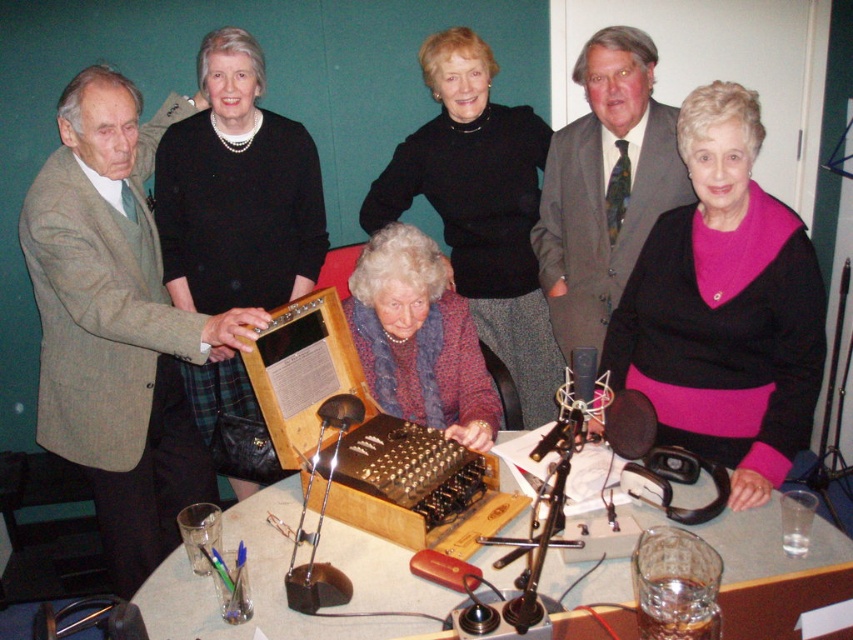
Consider the image. Can you confirm if light brown woolen suit at left is taller than gray suit at center?

Indeed, light brown woolen suit at left has a greater height compared to gray suit at center.

Is point (103, 193) positioned in front of point (549, 308)?

Yes, it is in front of point (549, 308).

The image size is (853, 640). What do you see at coordinates (117, 324) in the screenshot?
I see `light brown woolen suit at left` at bounding box center [117, 324].

Find the location of a particular element. The image size is (853, 640). light brown woolen suit at left is located at coordinates (117, 324).

Can you confirm if black matte sweater at center is positioned below gray suit at center?

Indeed, black matte sweater at center is positioned under gray suit at center.

Measure the distance between black matte sweater at center and camera.

black matte sweater at center is 1.69 meters from camera.

This screenshot has width=853, height=640. Find the location of `black matte sweater at center`. black matte sweater at center is located at coordinates (724, 307).

Between wooden table at center and gray suit at center, which one is positioned lower?

wooden table at center is lower down.

Can you confirm if wooden table at center is smaller than gray suit at center?

Correct, wooden table at center occupies less space than gray suit at center.

Which is in front, point (717, 529) or point (556, 339)?

Point (717, 529) is in front.

Locate an element on the screen. wooden table at center is located at coordinates (253, 586).